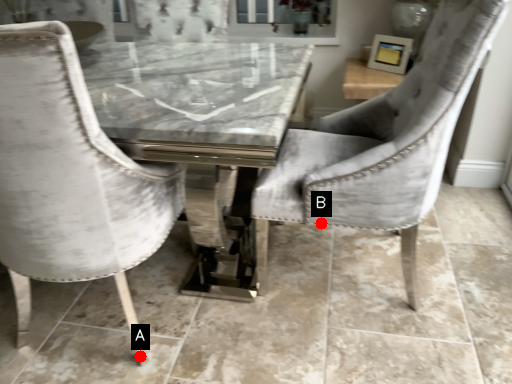
Question: Two points are circled on the image, labeled by A and B beside each circle. Which of the following is the closest to the observer?

Choices:
 (A) A is closer
 (B) B is closer

Answer: (B)